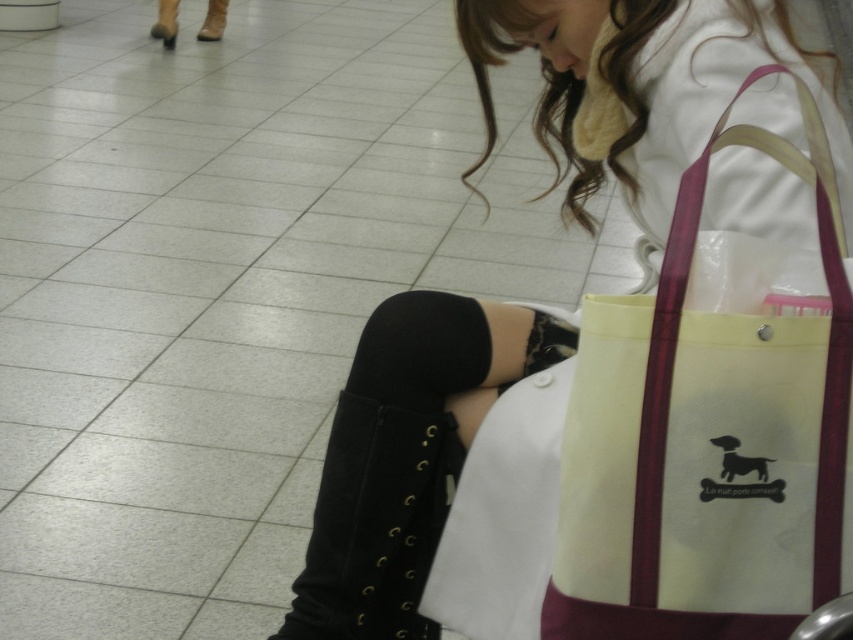
Which is in front, point (677, 548) or point (368, 612)?

Point (677, 548)

Does beige canvas tote at right have a smaller size compared to black leather boot at lower center?

Actually, beige canvas tote at right might be larger than black leather boot at lower center.

You are a GUI agent. You are given a task and a screenshot of the screen. Output one action in this format:
    pyautogui.click(x=<x>, y=<y>)
    Task: Click on the beige canvas tote at right
    
    Given the screenshot: What is the action you would take?
    pyautogui.click(x=706, y=444)

At what (x,y) coordinates should I click in order to perform the action: click on matte black thigh-high boots at lower left. Please return your answer as a coordinate pair (x, y). This screenshot has height=640, width=853. Looking at the image, I should click on coord(407,454).

Who is more distant from viewer, (576, 208) or (445, 449)?

The point (576, 208) is behind.

The height and width of the screenshot is (640, 853). Find the location of `matte black thigh-high boots at lower left`. matte black thigh-high boots at lower left is located at coordinates (407, 454).

Can you confirm if matte black thigh-high boots at lower left is thinner than beige canvas tote at right?

In fact, matte black thigh-high boots at lower left might be wider than beige canvas tote at right.

Which of these two, matte black thigh-high boots at lower left or beige canvas tote at right, stands shorter?

Standing shorter between the two is beige canvas tote at right.

Locate an element on the screen. Image resolution: width=853 pixels, height=640 pixels. matte black thigh-high boots at lower left is located at coordinates (407, 454).

Identify the location of matte black thigh-high boots at lower left. The image size is (853, 640). (407, 454).